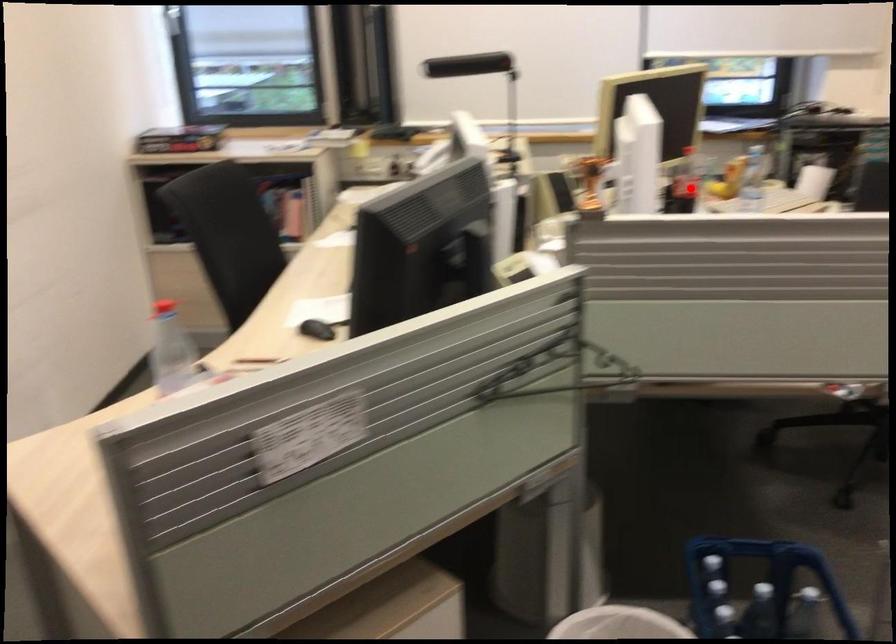
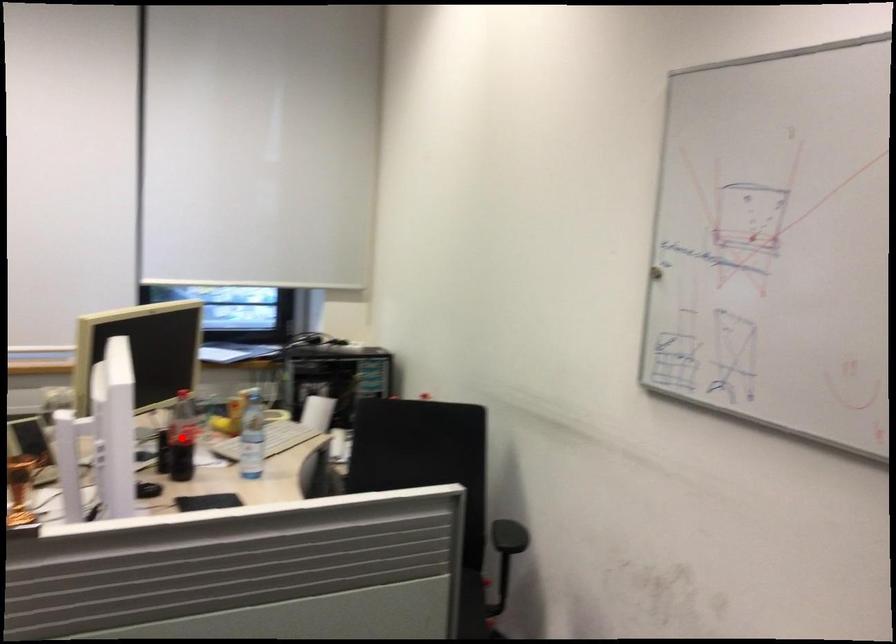
I am providing you with two images of the same scene from different viewpoints. A red point is marked on the first image and another point is marked on the second image. Do the highlighted points in image1 and image2 indicate the same real-world spot?

Yes